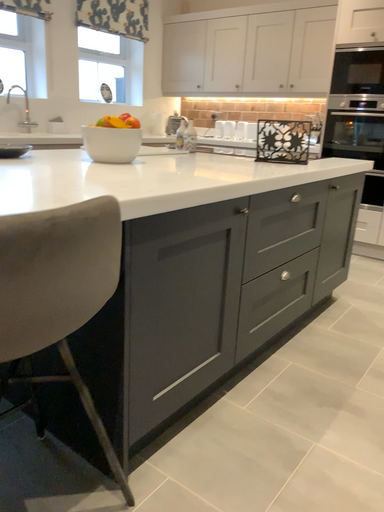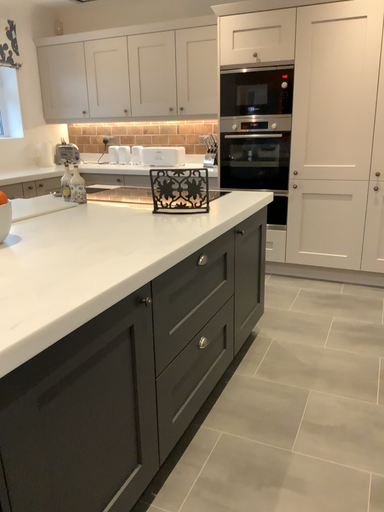
Question: How did the camera likely rotate when shooting the video?

Choices:
 (A) rotated right
 (B) rotated left

Answer: (A)